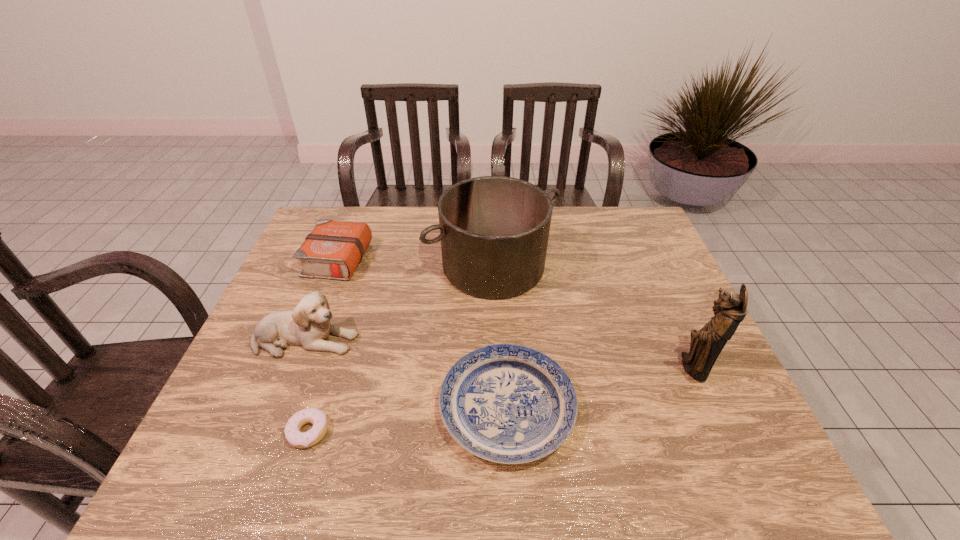
Locate an element on the screen. free point between the Bible and the pan is located at coordinates point(415,263).

The width and height of the screenshot is (960, 540). I want to click on vacant space that is in between the third shortest object and the fifth shortest object, so (x=415, y=263).

At what (x,y) coordinates should I click in order to perform the action: click on vacant point located between the pan and the doughnut. Please return your answer as a coordinate pair (x, y). The height and width of the screenshot is (540, 960). Looking at the image, I should click on (400, 349).

I want to click on free area in between the figurine and the fifth tallest object, so click(x=600, y=388).

The width and height of the screenshot is (960, 540). Identify the location of free point between the doughnut and the second tallest object. (400, 349).

The width and height of the screenshot is (960, 540). In order to click on free space between the fifth tallest object and the pan in this screenshot , I will do `click(500, 337)`.

The height and width of the screenshot is (540, 960). What are the coordinates of `vacant area that lies between the plate and the third tallest object` in the screenshot? It's located at (406, 374).

Where is `the fourth closest object relative to the fourth shortest object`? The height and width of the screenshot is (540, 960). the fourth closest object relative to the fourth shortest object is located at coordinates (506, 403).

Identify which object is the third closest to the fifth shortest object. Please provide its 2D coordinates. Your answer should be formatted as a tuple, i.e. [(x, y)], where the tuple contains the x and y coordinates of a point satisfying the conditions above.

[(506, 403)]

The image size is (960, 540). I want to click on free space in the image that satisfies the following two spatial constraints: 1. on the back side of the plate; 2. on the right side of the doughnut, so click(316, 408).